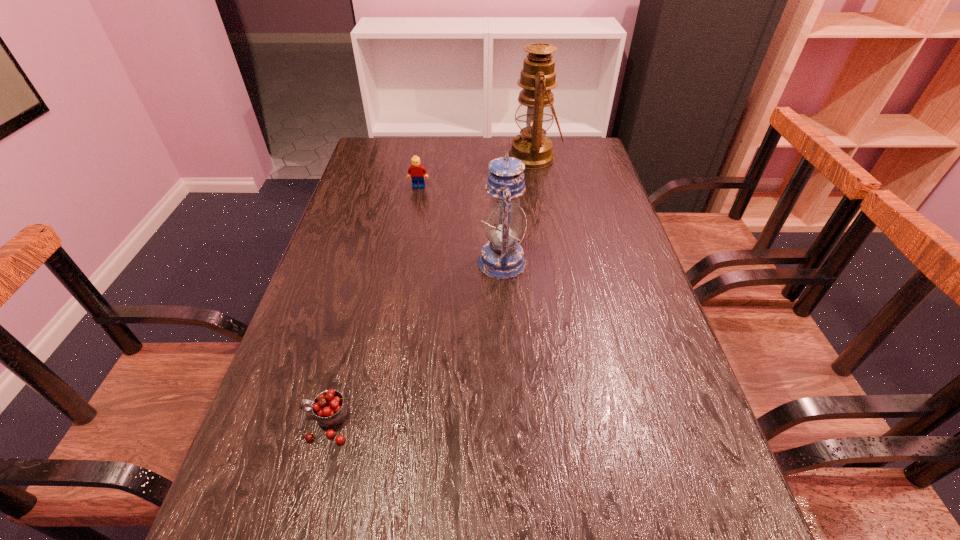
In order to click on the farthest object in this screenshot , I will do `click(535, 109)`.

I want to click on oil lamp, so click(535, 109).

What are the coordinates of `the second tallest object` in the screenshot? It's located at (502, 258).

Find the location of `the second nearest object`. the second nearest object is located at coordinates (502, 258).

Find the location of `the third object from right to left`. the third object from right to left is located at coordinates (417, 171).

Image resolution: width=960 pixels, height=540 pixels. What are the coordinates of `Lego` in the screenshot? It's located at (417, 171).

Where is `the shortest object`? Image resolution: width=960 pixels, height=540 pixels. the shortest object is located at coordinates (330, 409).

The image size is (960, 540). I want to click on the nearest object, so click(330, 409).

Locate an element on the screen. vacant space located 0.290m on the front of the oil lamp is located at coordinates (546, 231).

The height and width of the screenshot is (540, 960). Find the location of `free space located 0.100m on the front-facing side of the third shortest object`. free space located 0.100m on the front-facing side of the third shortest object is located at coordinates (439, 262).